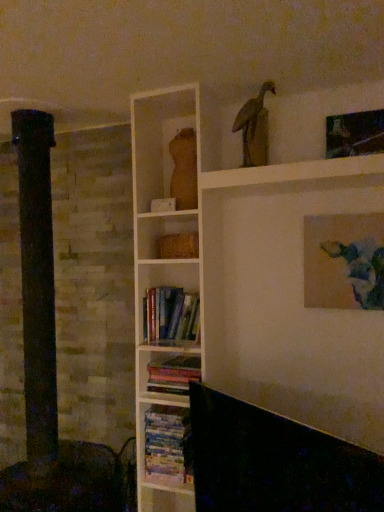
Question: Considering the relative positions of metallic silver picture frame at upper right, positioned as the second picture frame in bottom-to-top order, and hardcover books at center, marked as the third book in a bottom-to-top arrangement, in the image provided, is metallic silver picture frame at upper right, positioned as the second picture frame in bottom-to-top order, to the left or to the right of hardcover books at center, marked as the third book in a bottom-to-top arrangement,?

Choices:
 (A) left
 (B) right

Answer: (B)

Question: Is metallic silver picture frame at upper right, positioned as the second picture frame in bottom-to-top order, taller or shorter than hardcover books at center, marked as the first book in a top-to-bottom arrangement?

Choices:
 (A) short
 (B) tall

Answer: (A)

Question: Which object is positioned closest to the hardcover books at center, marked as the first book in a top-to-bottom arrangement?

Choices:
 (A) wooden statue at upper center
 (B) metallic silver picture frame at upper right, which ranks as the first picture frame in top-to-bottom order
 (C) hardcover books at center, which ranks as the 3th book in top-to-bottom order
 (D) matte wooden torso at upper center
 (E) matte canvas painting at upper right, which ranks as the first picture frame in bottom-to-top order

Answer: (C)

Question: Which object is positioned closest to the metallic silver picture frame at upper right, positioned as the second picture frame in bottom-to-top order?

Choices:
 (A) matte wooden torso at upper center
 (B) wooden statue at upper center
 (C) hardcover books at center, marked as the third book in a bottom-to-top arrangement
 (D) hardcover books at center, the 1th book ordered from the bottom
 (E) hardcover books at center, the second book when ordered from top to bottom

Answer: (B)